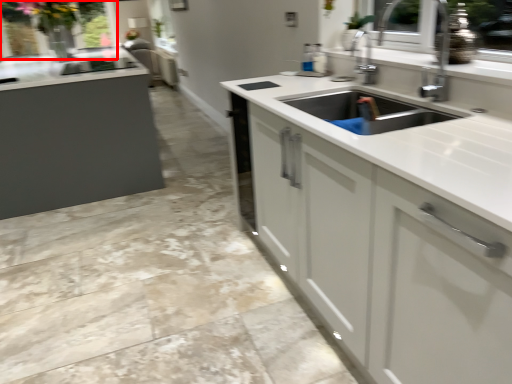
Question: From the image's perspective, where is window screen (annotated by the red box) located relative to countertop?

Choices:
 (A) above
 (B) below

Answer: (A)